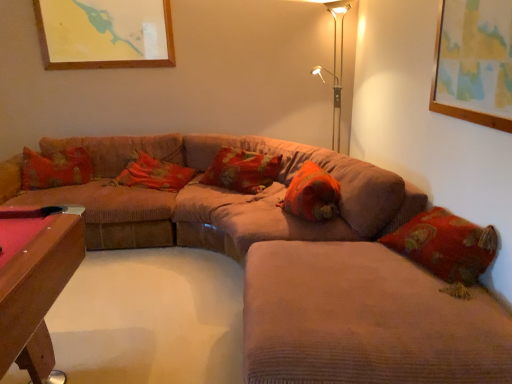
Identify the location of corduroy couch at center, marked as the first couch in a back-to-front arrangement. This screenshot has height=384, width=512. (217, 196).

At what (x,y) coordinates should I click in order to perform the action: click on floral fabric pillow at center, marked as the second pillow in a right-to-left arrangement. Please return your answer as a coordinate pair (x, y). Looking at the image, I should click on (242, 170).

Where is `metallic gold table lamp at upper right`? Image resolution: width=512 pixels, height=384 pixels. metallic gold table lamp at upper right is located at coordinates (336, 67).

The width and height of the screenshot is (512, 384). Describe the element at coordinates (154, 174) in the screenshot. I see `velvet floral pillow at center, the third pillow positioned from the right` at that location.

The height and width of the screenshot is (384, 512). I want to click on orange fabric pillow at center, marked as the 1th pillow in a right-to-left arrangement, so click(x=312, y=194).

Describe the element at coordinates (364, 319) in the screenshot. I see `velvet beige couch at center, the first couch in the front-to-back sequence` at that location.

In order to click on corduroy couch at center, which ranks as the 2th couch in front-to-back order in this screenshot , I will do `click(217, 196)`.

Is metallic gold table lamp at upper right not inside velvet beige couch at center, the first couch in the front-to-back sequence?

metallic gold table lamp at upper right is positioned outside velvet beige couch at center, the first couch in the front-to-back sequence.

Does metallic gold table lamp at upper right appear on the left side of velvet beige couch at center, the second couch in the back-to-front sequence?

No, metallic gold table lamp at upper right is not to the left of velvet beige couch at center, the second couch in the back-to-front sequence.

Considering the points (335, 57) and (243, 321), which point is behind, point (335, 57) or point (243, 321)?

The point (335, 57) is farther.

Looking at the image, does metallic gold table lamp at upper right seem bigger or smaller compared to velvet beige couch at center, the second couch in the back-to-front sequence?

In the image, metallic gold table lamp at upper right appears to be smaller than velvet beige couch at center, the second couch in the back-to-front sequence.

From a real-world perspective, who is located higher, orange fabric pillow at center, which ranks as the 3th pillow in left-to-right order, or floral fabric pillow at center, which is counted as the 2th pillow, starting from the left?

floral fabric pillow at center, which is counted as the 2th pillow, starting from the left.

From the image's perspective, is orange fabric pillow at center, marked as the 1th pillow in a right-to-left arrangement, below floral fabric pillow at center, which is counted as the 2th pillow, starting from the left?

Yes, from the image's perspective, orange fabric pillow at center, marked as the 1th pillow in a right-to-left arrangement, is below floral fabric pillow at center, which is counted as the 2th pillow, starting from the left.

Does orange fabric pillow at center, which ranks as the 3th pillow in left-to-right order, appear on the left side of floral fabric pillow at center, which is counted as the 2th pillow, starting from the left?

No, orange fabric pillow at center, which ranks as the 3th pillow in left-to-right order, is not to the left of floral fabric pillow at center, which is counted as the 2th pillow, starting from the left.

Find the location of `table lamp on the right of the velvet floral pillow at center, the third pillow positioned from the right`. table lamp on the right of the velvet floral pillow at center, the third pillow positioned from the right is located at coordinates (336, 67).

From a real-world perspective, is velvet floral pillow at center, which is the 1th pillow from left to right, positioned over metallic gold table lamp at upper right based on gravity?

No, from a real-world perspective, velvet floral pillow at center, which is the 1th pillow from left to right, is not above metallic gold table lamp at upper right.

Who is more distant, velvet floral pillow at center, the third pillow positioned from the right, or metallic gold table lamp at upper right?

velvet floral pillow at center, the third pillow positioned from the right, is more distant.

Based on the photo, which of these two, velvet floral pillow at center, the third pillow positioned from the right, or metallic gold table lamp at upper right, is bigger?

metallic gold table lamp at upper right.

Between point (154, 237) and point (260, 176), which one is positioned in front?

Point (154, 237)

Looking at their sizes, would you say corduroy couch at center, which ranks as the 2th couch in front-to-back order, is wider or thinner than floral fabric pillow at center, which is counted as the 2th pillow, starting from the left?

Considering their sizes, corduroy couch at center, which ranks as the 2th couch in front-to-back order, looks broader than floral fabric pillow at center, which is counted as the 2th pillow, starting from the left.

Is corduroy couch at center, marked as the first couch in a back-to-front arrangement, shorter than floral fabric pillow at center, marked as the second pillow in a right-to-left arrangement?

No, corduroy couch at center, marked as the first couch in a back-to-front arrangement, is not shorter than floral fabric pillow at center, marked as the second pillow in a right-to-left arrangement.

Which object is further away from the camera taking this photo, corduroy couch at center, marked as the first couch in a back-to-front arrangement, or floral fabric pillow at center, marked as the second pillow in a right-to-left arrangement?

floral fabric pillow at center, marked as the second pillow in a right-to-left arrangement, is behind.

Is metallic gold table lamp at upper right completely or partially outside of velvet floral pillow at center, which is the 1th pillow from left to right?

That's correct, metallic gold table lamp at upper right is outside of velvet floral pillow at center, which is the 1th pillow from left to right.

In the scene shown: Is metallic gold table lamp at upper right positioned before velvet floral pillow at center, which is the 1th pillow from left to right?

Yes, metallic gold table lamp at upper right is in front of velvet floral pillow at center, which is the 1th pillow from left to right.

Considering the sizes of objects metallic gold table lamp at upper right and velvet floral pillow at center, which is the 1th pillow from left to right, in the image provided, who is wider, metallic gold table lamp at upper right or velvet floral pillow at center, which is the 1th pillow from left to right,?

Wider between the two is metallic gold table lamp at upper right.

Is metallic gold table lamp at upper right positioned with its back to velvet floral pillow at center, the third pillow positioned from the right?

metallic gold table lamp at upper right is not turned away from velvet floral pillow at center, the third pillow positioned from the right.

Can we say velvet floral pillow at center, the third pillow positioned from the right, lies outside floral fabric pillow at center, marked as the second pillow in a right-to-left arrangement?

Yes, velvet floral pillow at center, the third pillow positioned from the right, is outside of floral fabric pillow at center, marked as the second pillow in a right-to-left arrangement.

Which point is more forward, (185, 173) or (274, 156)?

The point (274, 156) is closer.

From the image's perspective, is velvet floral pillow at center, the third pillow positioned from the right, above or below floral fabric pillow at center, which is counted as the 2th pillow, starting from the left?

Based on their image positions, velvet floral pillow at center, the third pillow positioned from the right, is located beneath floral fabric pillow at center, which is counted as the 2th pillow, starting from the left.

Considering the sizes of velvet floral pillow at center, which is the 1th pillow from left to right, and floral fabric pillow at center, which is counted as the 2th pillow, starting from the left, in the image, is velvet floral pillow at center, which is the 1th pillow from left to right, taller or shorter than floral fabric pillow at center, which is counted as the 2th pillow, starting from the left,?

In the image, velvet floral pillow at center, which is the 1th pillow from left to right, appears to be shorter than floral fabric pillow at center, which is counted as the 2th pillow, starting from the left.

Is orange fabric pillow at center, marked as the 1th pillow in a right-to-left arrangement, at the back of velvet floral pillow at center, which is the 1th pillow from left to right?

velvet floral pillow at center, which is the 1th pillow from left to right, does not have its back to orange fabric pillow at center, marked as the 1th pillow in a right-to-left arrangement.

Based on the photo, is orange fabric pillow at center, marked as the 1th pillow in a right-to-left arrangement, inside velvet floral pillow at center, which is the 1th pillow from left to right?

No.

Is velvet floral pillow at center, the third pillow positioned from the right, shorter than orange fabric pillow at center, marked as the 1th pillow in a right-to-left arrangement?

No.

Based on the photo, based on their sizes in the image, would you say velvet floral pillow at center, which is the 1th pillow from left to right, is bigger or smaller than orange fabric pillow at center, marked as the 1th pillow in a right-to-left arrangement?

In the image, velvet floral pillow at center, which is the 1th pillow from left to right, appears to be larger than orange fabric pillow at center, marked as the 1th pillow in a right-to-left arrangement.

Identify the location of table lamp above the velvet beige couch at center, the second couch in the back-to-front sequence (from the image's perspective). (x=336, y=67).

Identify the location of the 1st pillow behind the orange fabric pillow at center, which ranks as the 3th pillow in left-to-right order. This screenshot has height=384, width=512. (242, 170).

Based on their spatial positions, is velvet floral pillow at center, the third pillow positioned from the right, or velvet beige couch at center, the second couch in the back-to-front sequence, further from orange fabric pillow at center, which ranks as the 3th pillow in left-to-right order?

velvet floral pillow at center, the third pillow positioned from the right, is further to orange fabric pillow at center, which ranks as the 3th pillow in left-to-right order.

Considering their positions, is orange fabric pillow at center, which ranks as the 3th pillow in left-to-right order, positioned further to corduroy couch at center, marked as the first couch in a back-to-front arrangement, than velvet floral pillow at center, which is the 1th pillow from left to right?

Among the two, orange fabric pillow at center, which ranks as the 3th pillow in left-to-right order, is located further to corduroy couch at center, marked as the first couch in a back-to-front arrangement.

From the image, which object appears to be nearer to metallic gold table lamp at upper right, corduroy couch at center, marked as the first couch in a back-to-front arrangement, or floral fabric pillow at center, marked as the second pillow in a right-to-left arrangement?

floral fabric pillow at center, marked as the second pillow in a right-to-left arrangement, is positioned closer to the anchor metallic gold table lamp at upper right.

Looking at the image, which one is located closer to metallic gold table lamp at upper right, velvet floral pillow at center, the third pillow positioned from the right, or corduroy couch at center, which ranks as the 2th couch in front-to-back order?

corduroy couch at center, which ranks as the 2th couch in front-to-back order, is closer to metallic gold table lamp at upper right.

When comparing their distances from velvet beige couch at center, the first couch in the front-to-back sequence, does floral fabric pillow at center, which is counted as the 2th pillow, starting from the left, or orange fabric pillow at center, marked as the 1th pillow in a right-to-left arrangement, seem further?

floral fabric pillow at center, which is counted as the 2th pillow, starting from the left, is positioned further to the anchor velvet beige couch at center, the first couch in the front-to-back sequence.

When comparing their distances from velvet beige couch at center, the first couch in the front-to-back sequence, does metallic gold table lamp at upper right or orange fabric pillow at center, marked as the 1th pillow in a right-to-left arrangement, seem closer?

The object closer to velvet beige couch at center, the first couch in the front-to-back sequence, is orange fabric pillow at center, marked as the 1th pillow in a right-to-left arrangement.

Based on their spatial positions, is corduroy couch at center, marked as the first couch in a back-to-front arrangement, or floral fabric pillow at center, marked as the second pillow in a right-to-left arrangement, closer to orange fabric pillow at center, marked as the 1th pillow in a right-to-left arrangement?

corduroy couch at center, marked as the first couch in a back-to-front arrangement.

Looking at this image, which object lies nearer to the anchor point velvet floral pillow at center, which is the 1th pillow from left to right, orange fabric pillow at center, which ranks as the 3th pillow in left-to-right order, or velvet beige couch at center, the first couch in the front-to-back sequence?

Among the two, orange fabric pillow at center, which ranks as the 3th pillow in left-to-right order, is located nearer to velvet floral pillow at center, which is the 1th pillow from left to right.

This screenshot has height=384, width=512. What are the coordinates of `pillow situated between corduroy couch at center, which ranks as the 2th couch in front-to-back order, and orange fabric pillow at center, which ranks as the 3th pillow in left-to-right order, from left to right` in the screenshot? It's located at (242, 170).

At what (x,y) coordinates should I click in order to perform the action: click on couch positioned between velvet beige couch at center, the second couch in the back-to-front sequence, and metallic gold table lamp at upper right from near to far. Please return your answer as a coordinate pair (x, y). The image size is (512, 384). Looking at the image, I should click on (217, 196).

Where is `pillow between velvet beige couch at center, the second couch in the back-to-front sequence, and floral fabric pillow at center, which is counted as the 2th pillow, starting from the left, along the z-axis`? pillow between velvet beige couch at center, the second couch in the back-to-front sequence, and floral fabric pillow at center, which is counted as the 2th pillow, starting from the left, along the z-axis is located at coordinates (312, 194).

Find the location of a particular element. The image size is (512, 384). pillow between velvet floral pillow at center, which is the 1th pillow from left to right, and orange fabric pillow at center, which ranks as the 3th pillow in left-to-right order is located at coordinates (242, 170).